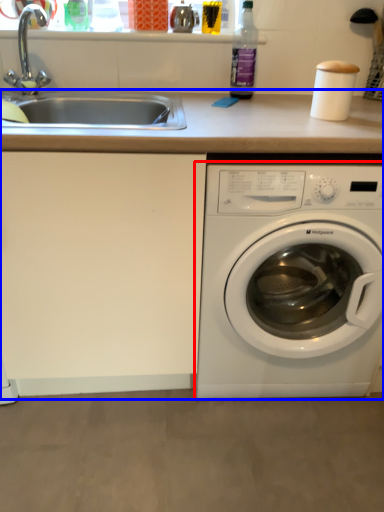
Question: Among these objects, which one is farthest to the camera, washing machine (highlighted by a red box) or counter top (highlighted by a blue box)?

Choices:
 (A) washing machine
 (B) counter top

Answer: (A)